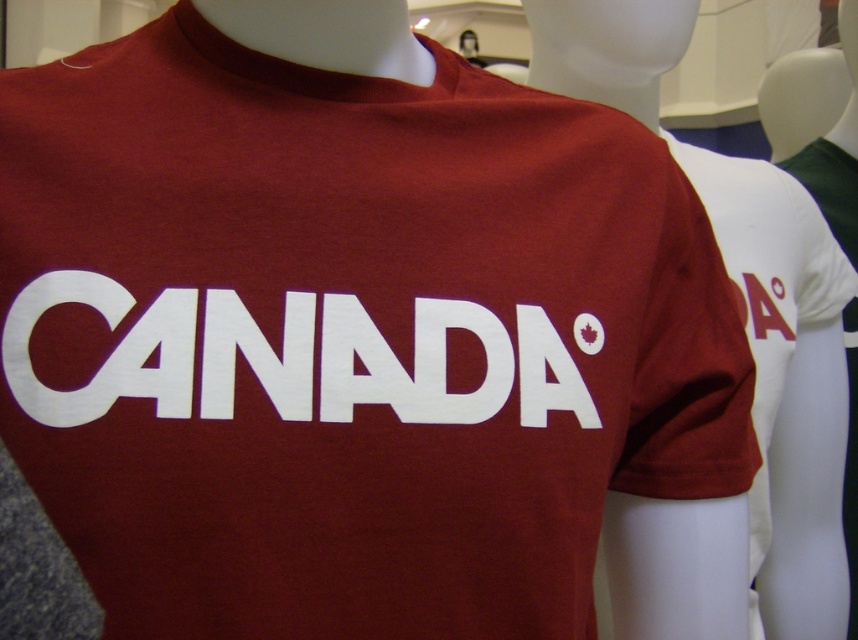
You are a customer in a clothing store looking at a mannequin wearing a maroon tshirt. You notice two elements on the shirt. The first is the white matte text at center, and the second is the matte red maple leaf at center. Which of these two elements is positioned to the right side of the other?

The white matte text at center is to the left of the matte red maple leaf at center, so the matte red maple leaf at center is positioned to the right of the white matte text at center.